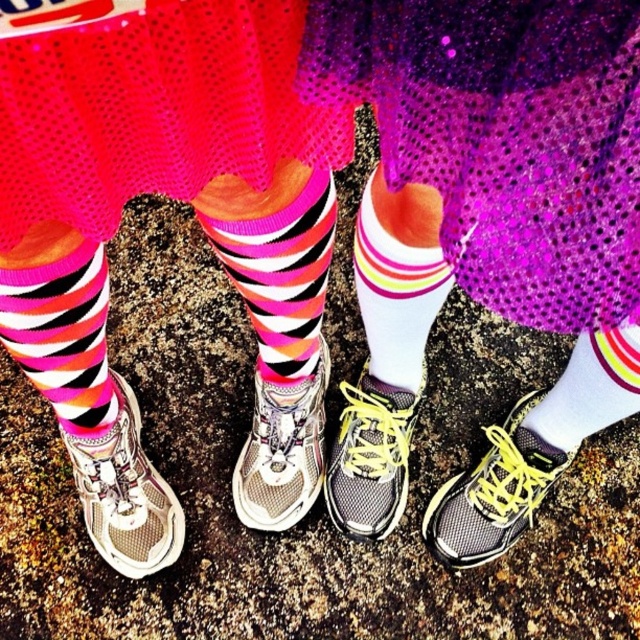
You are a fashion designer observing two people standing side by side. You notice the multicolored striped sock at center and the white matte sock at center. Which sock is located to the left of the other?

The multicolored striped sock at center is positioned on the left side of white matte sock at center.

You are designing a new pair of shoes and need to accommodate both the multicolored striped sock at center and the white matte sock at center. Which sock requires a wider shoe compartment?

The multicolored striped sock at center requires a wider shoe compartment because its width is larger than the white matte sock at center.